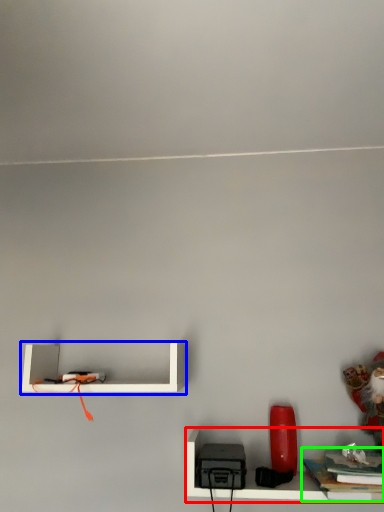
Question: Which object is positioned closest to shelf (highlighted by a red box)? Select from shelf (highlighted by a blue box) and book (highlighted by a green box).

Choices:
 (A) shelf
 (B) book

Answer: (B)